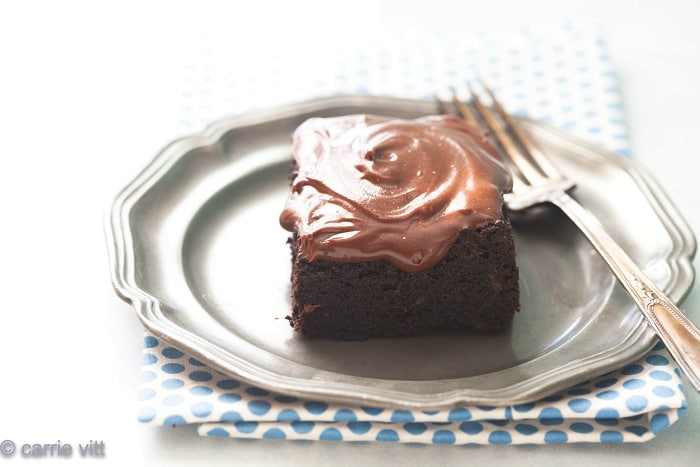
This screenshot has width=700, height=467. Find the location of `plate`. plate is located at coordinates coord(540,343).